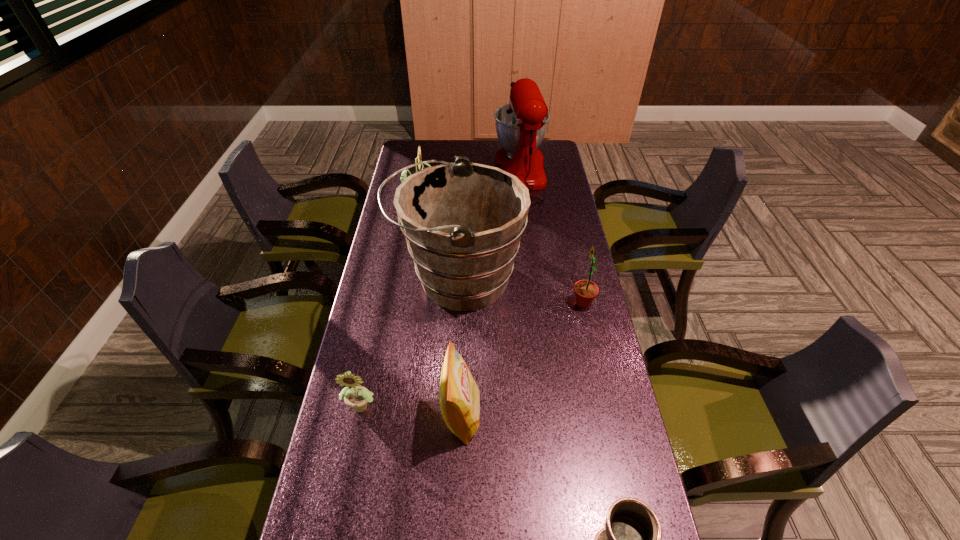
You are a GUI agent. You are given a task and a screenshot of the screen. Output one action in this format:
    pyautogui.click(x=<x>, y=<y>)
    Task: Click on the mixer
    This screenshot has width=960, height=540.
    Given the screenshot: What is the action you would take?
    pyautogui.click(x=521, y=125)

Locate an element on the screen. The height and width of the screenshot is (540, 960). bucket is located at coordinates (463, 221).

The image size is (960, 540). I want to click on the bigger yellow sunflower, so tap(403, 176).

Find the location of a particular element. The image size is (960, 540). the farthest sunflower is located at coordinates (403, 176).

You are a GUI agent. You are given a task and a screenshot of the screen. Output one action in this format:
    pyautogui.click(x=<x>, y=<y>)
    Task: Click on the rightmost sunflower
    Image resolution: width=960 pixels, height=540 pixels.
    Given the screenshot: What is the action you would take?
    pyautogui.click(x=586, y=291)

Where is `green sunflower`? green sunflower is located at coordinates (586, 291).

Locate an element on the screen. The height and width of the screenshot is (540, 960). crisp (potato chip) is located at coordinates (459, 396).

Where is `the smaller yellow sunflower`? the smaller yellow sunflower is located at coordinates (357, 397).

Locate an element on the screen. The image size is (960, 540). the nearer yellow sunflower is located at coordinates (357, 397).

You are a GUI agent. You are given a task and a screenshot of the screen. Output one action in this format:
    pyautogui.click(x=<x>, y=<y>)
    Task: Click on the vacant space located 0.250m on the bowl side of the mixer
    Image resolution: width=960 pixels, height=540 pixels.
    Given the screenshot: What is the action you would take?
    pyautogui.click(x=418, y=174)